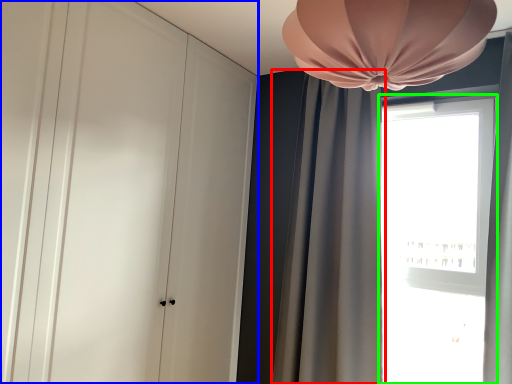
Question: Estimate the real-world distances between objects in this image. Which object is farther from curtain (highlighted by a red box), dresser (highlighted by a blue box) or window (highlighted by a green box)?

Choices:
 (A) dresser
 (B) window

Answer: (A)